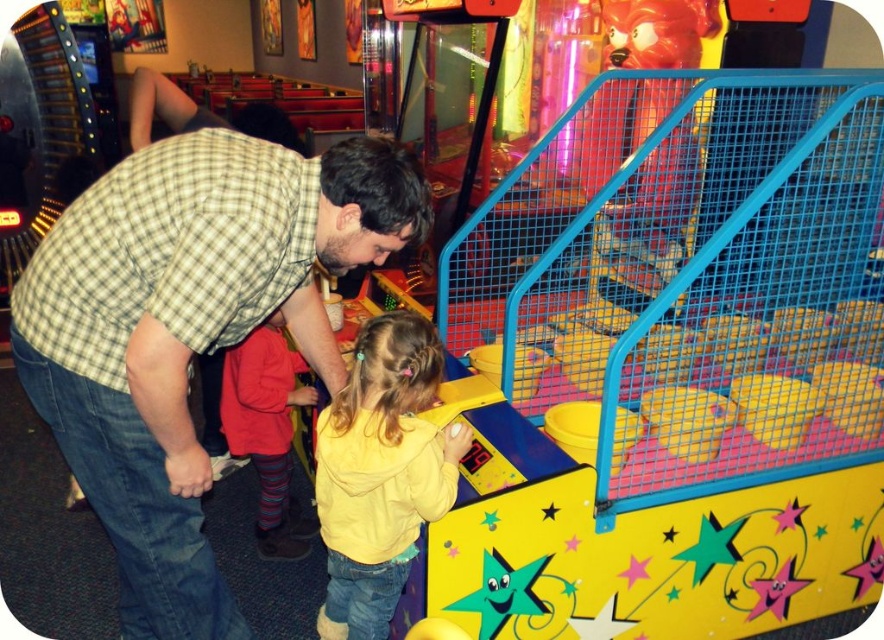
Question: Among these points, which one is farthest from the camera?

Choices:
 (A) (435, 381)
 (B) (258, 365)

Answer: (B)

Question: Is checkered fabric shirt at center positioned behind yellow fleece jacket at center?

Choices:
 (A) yes
 (B) no

Answer: (B)

Question: Based on their relative distances, which object is nearer to the yellow fleece jacket at center?

Choices:
 (A) checkered fabric shirt at center
 (B) red knit sweater at lower left

Answer: (A)

Question: Is checkered fabric shirt at center closer to the viewer compared to yellow fleece jacket at center?

Choices:
 (A) yes
 (B) no

Answer: (A)

Question: Which object appears closest to the camera in this image?

Choices:
 (A) checkered fabric shirt at center
 (B) red knit sweater at lower left
 (C) yellow fleece jacket at center

Answer: (A)

Question: Can you confirm if checkered fabric shirt at center is positioned to the right of yellow fleece jacket at center?

Choices:
 (A) no
 (B) yes

Answer: (A)